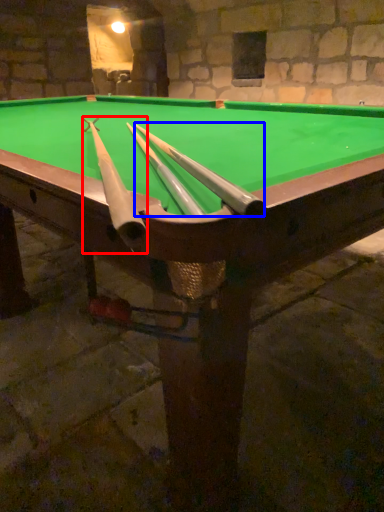
Question: Among these objects, which one is farthest to the camera, cue (highlighted by a red box) or cue (highlighted by a blue box)?

Choices:
 (A) cue
 (B) cue

Answer: (B)